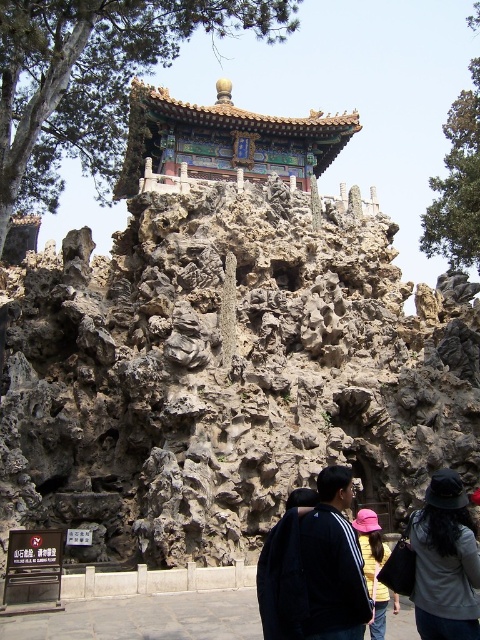
Between brown rough rock face at center and pink fabric hat at center, which one has more height?

brown rough rock face at center is taller.

Is point (136, 516) farther from camera compared to point (377, 592)?

Yes, it is behind point (377, 592).

What do you see at coordinates (226, 376) in the screenshot? I see `brown rough rock face at center` at bounding box center [226, 376].

You are a GUI agent. You are given a task and a screenshot of the screen. Output one action in this format:
    pyautogui.click(x=<x>, y=<y>)
    Task: Click on the brown rough rock face at center
    The width and height of the screenshot is (480, 640).
    Given the screenshot: What is the action you would take?
    pyautogui.click(x=226, y=376)

Is brown rough rock face at center closer to camera compared to black matte jacket at lower center?

That is False.

Which is below, brown rough rock face at center or black matte jacket at lower center?

Positioned lower is black matte jacket at lower center.

Who is more distant from viewer, (x=78, y=292) or (x=290, y=620)?

→ Positioned behind is point (x=78, y=292).

Find the location of a particular element. brown rough rock face at center is located at coordinates (226, 376).

Does point (340, 284) come behind point (408, 528)?

Yes.

The height and width of the screenshot is (640, 480). What do you see at coordinates (226, 376) in the screenshot?
I see `brown rough rock face at center` at bounding box center [226, 376].

At what (x,y) coordinates should I click in order to perform the action: click on brown rough rock face at center. Please return your answer as a coordinate pair (x, y). Looking at the image, I should click on (226, 376).